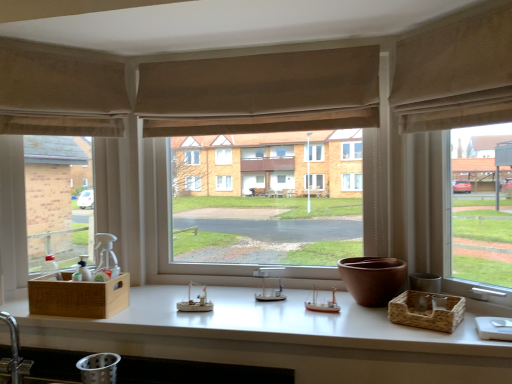
Where is `free spot above beige textured curtain at center, the first curtain viewed from the back (from a real-world perspective)`? free spot above beige textured curtain at center, the first curtain viewed from the back (from a real-world perspective) is located at coordinates [269, 48].